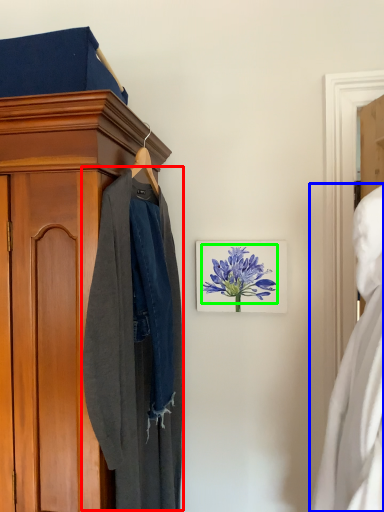
Question: Estimate the real-world distances between objects in this image. Which object is closer to clothing (highlighted by a red box), dress (highlighted by a blue box) or flower (highlighted by a green box)?

Choices:
 (A) dress
 (B) flower

Answer: (B)